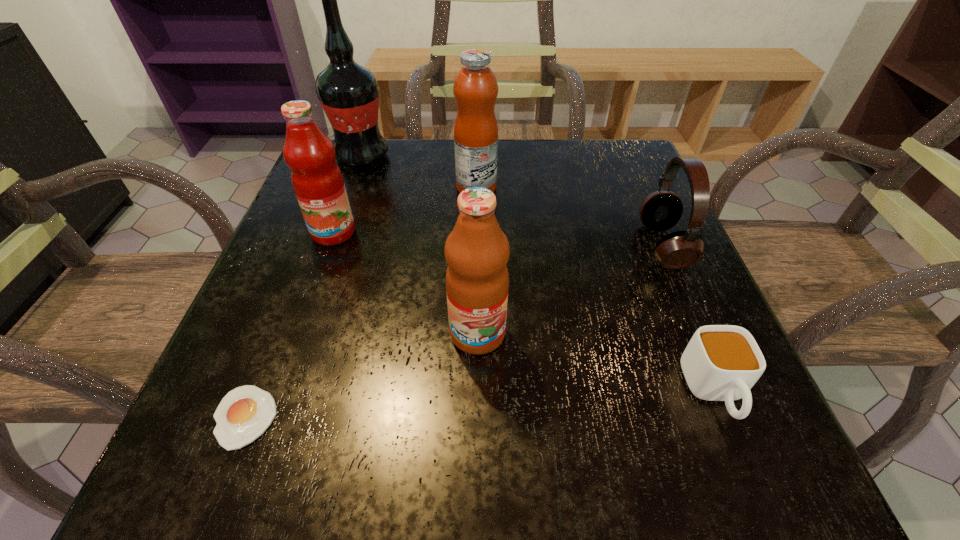
Locate an element on the screen. Image resolution: width=960 pixels, height=540 pixels. vacant space located 0.090m on the front label of the nearest fruit juice is located at coordinates (477, 414).

Find the location of a particular element. Image resolution: width=960 pixels, height=540 pixels. vacant region located on the front label of the second nearest fruit juice is located at coordinates (320, 271).

Locate an element on the screen. vacant space located on the ear pads of the third shortest object is located at coordinates (518, 246).

I want to click on free space located 0.080m on the ear pads of the third shortest object, so click(x=599, y=246).

Locate an element on the screen. This screenshot has height=540, width=960. vacant point located 0.120m on the ear pads of the third shortest object is located at coordinates (578, 246).

Find the location of a particular element. This screenshot has height=540, width=960. vacant area located on the side with the handle of the cup is located at coordinates (751, 481).

Locate an element on the screen. Image resolution: width=960 pixels, height=540 pixels. free location located on the back of the shortest object is located at coordinates (323, 220).

Find the location of a particular element. The image size is (960, 540). wine bottle located at the far edge is located at coordinates (348, 92).

Image resolution: width=960 pixels, height=540 pixels. Find the location of `fruit juice that is at the far edge`. fruit juice that is at the far edge is located at coordinates (475, 88).

Identify the location of cup that is at the near edge. (721, 362).